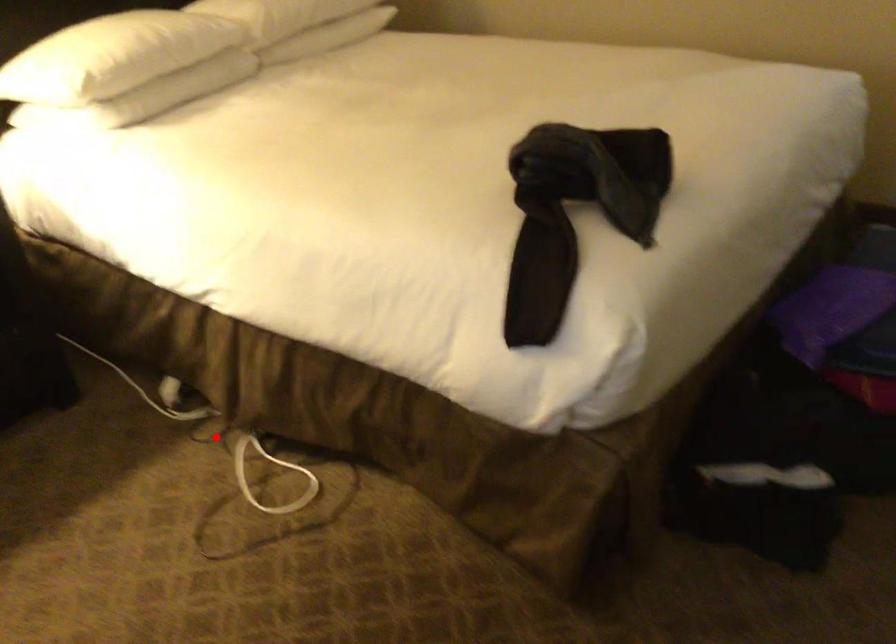
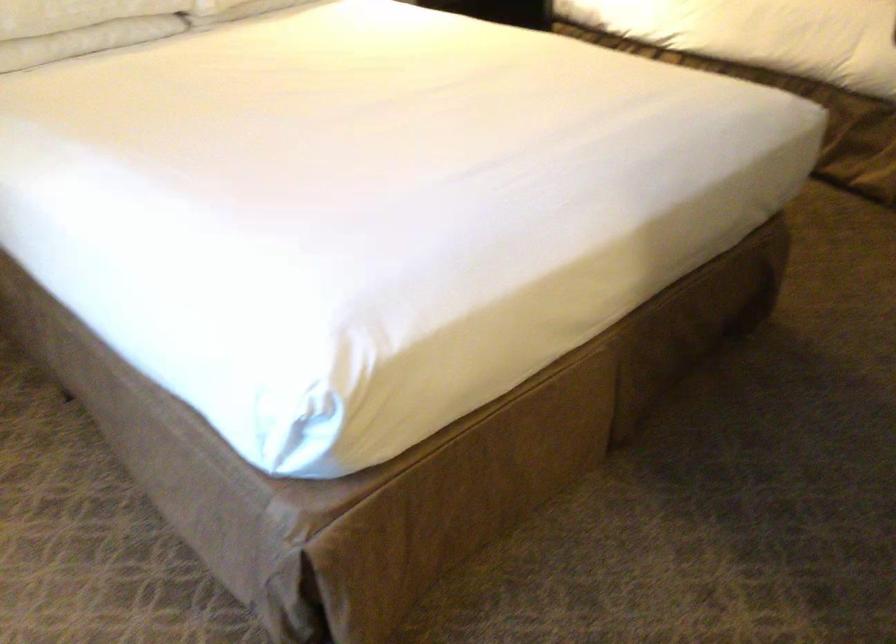
Question: I am providing you with two images of the same scene from different viewpoints. A red point is marked on the first image. Can you still see the location of the red point in image 2?

Choices:
 (A) Yes
 (B) No

Answer: (B)